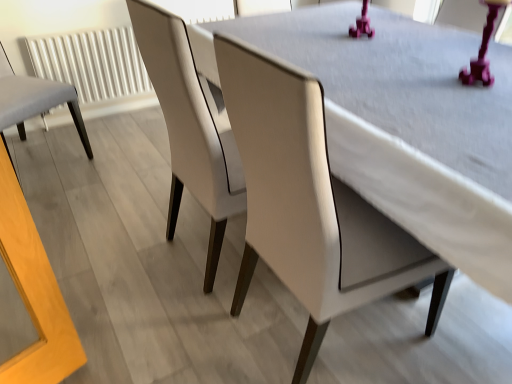
Question: Is light gray fabric chair at left, the 1th chair in the left-to-right sequence, taller or shorter than matte white chair at center, arranged as the 2th chair when viewed from the left?

Choices:
 (A) short
 (B) tall

Answer: (A)

Question: Is light gray fabric chair at left, the 1th chair in the left-to-right sequence, inside the boundaries of matte white chair at center, placed as the second chair when sorted from right to left, or outside?

Choices:
 (A) inside
 (B) outside

Answer: (B)

Question: Which object is the closest to the matte white chair at center, placed as the second chair when sorted from right to left?

Choices:
 (A) white textured radiator at left
 (B) white leather chair at center, the 1th chair in the right-to-left sequence
 (C) light gray fabric chair at left, which appears as the third chair when viewed from the right

Answer: (B)

Question: Based on their relative distances, which object is nearer to the matte white chair at center, placed as the second chair when sorted from right to left?

Choices:
 (A) white textured radiator at left
 (B) light gray fabric chair at left, the 1th chair in the left-to-right sequence
 (C) white leather chair at center, positioned as the third chair in left-to-right order

Answer: (C)